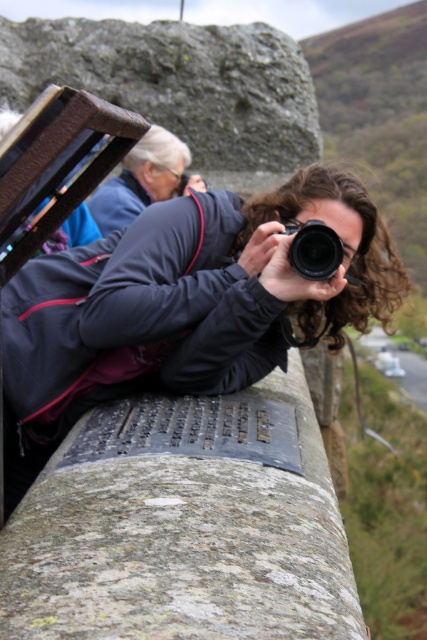
Question: Can you confirm if matte blue jacket at upper left is positioned to the right of black plastic camera at center?

Choices:
 (A) yes
 (B) no

Answer: (B)

Question: Which of the following is the closest to the observer?

Choices:
 (A) black plastic camera at center
 (B) matte blue jacket at upper left

Answer: (A)

Question: Considering the relative positions of matte black jacket at center and matte blue jacket at upper left in the image provided, where is matte black jacket at center located with respect to matte blue jacket at upper left?

Choices:
 (A) left
 (B) right

Answer: (B)

Question: Which point appears closest to the camera in this image?

Choices:
 (A) (148, 173)
 (B) (61, 305)

Answer: (B)

Question: Which of the following is the closest to the observer?

Choices:
 (A) matte blue jacket at upper left
 (B) black plastic camera at center

Answer: (B)

Question: Where is matte black jacket at center located in relation to black plastic camera at center in the image?

Choices:
 (A) right
 (B) left

Answer: (B)